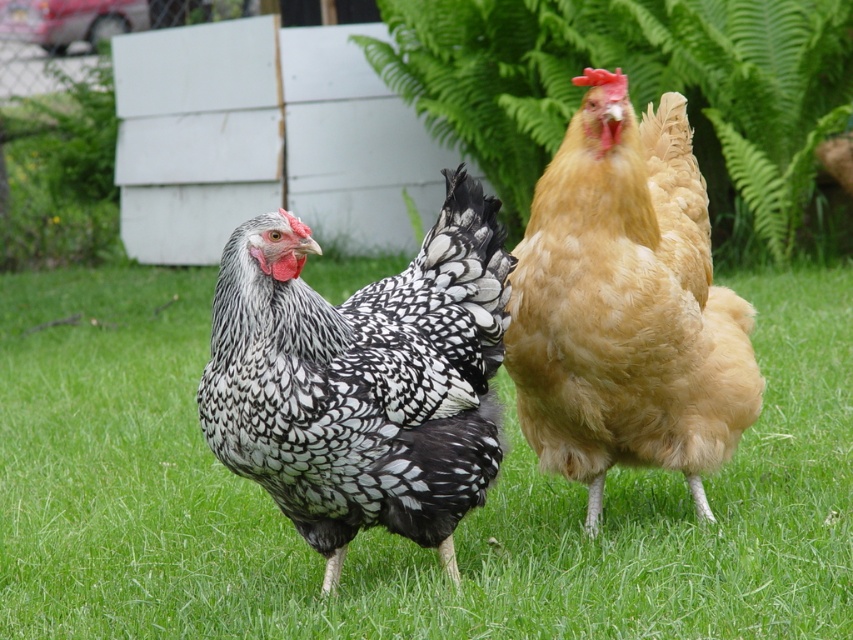
You are a gardener checking the growth of plants in the garden. You see the green grass at center and the green leafy fern at upper center. Which of these two has a wider spread?

The green leafy fern at upper center has a wider spread than the green grass at center.

You are a farmer checking the coop area. You see the golden fluffy chicken at center. Where exactly is it positioned in relation to the white wooden fence behind them?

The golden fluffy chicken at center is positioned at coordinates point (625, 305), which places it near the center of the image, closer to the white wooden fence in the background.

You are a farmer checking the coop area. You notice the golden fluffy chicken at center and the green leafy fern at upper center. Which object has a smaller width?

The golden fluffy chicken at center is thinner than the green leafy fern at upper center, so the golden fluffy chicken at center has a smaller width.